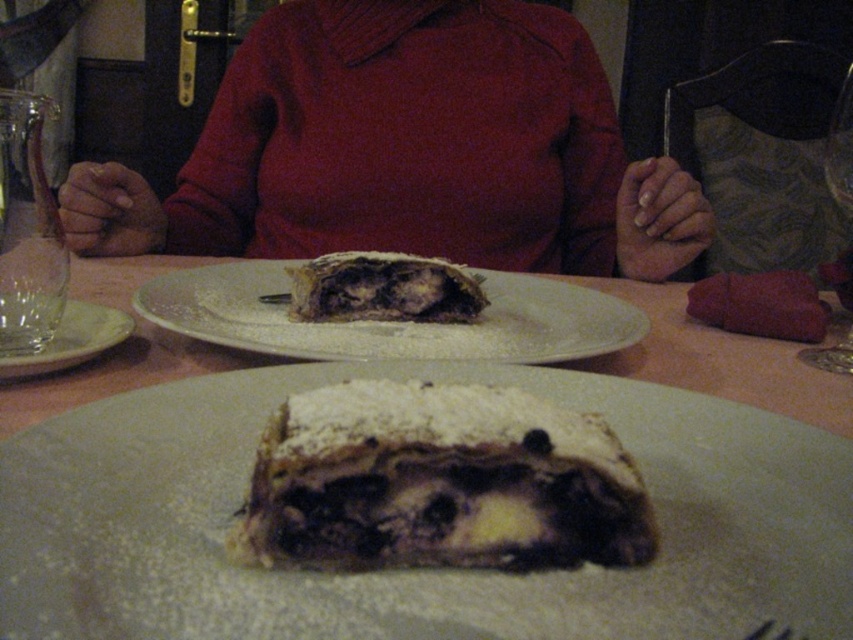
In the scene shown: Is powdery white pastry at center smaller than dusty brown pastry at center?

Yes, powdery white pastry at center is smaller than dusty brown pastry at center.

Is powdery white pastry at center taller than dusty brown pastry at center?

Yes.

This screenshot has width=853, height=640. Find the location of `powdery white pastry at center`. powdery white pastry at center is located at coordinates (440, 483).

Which is above, matte red sweater at center or white ceramic plate at center?

Positioned higher is matte red sweater at center.

Can you confirm if matte red sweater at center is thinner than white ceramic plate at center?

Incorrect, matte red sweater at center's width is not less than white ceramic plate at center's.

Is point (448, 134) positioned before point (506, 282)?

That is False.

Locate an element on the screen. matte red sweater at center is located at coordinates (407, 148).

Can you confirm if powdered white cake at center is wider than dusty brown pastry at center?

Yes, powdered white cake at center is wider than dusty brown pastry at center.

Based on the photo, is powdered white cake at center to the left of dusty brown pastry at center from the viewer's perspective?

In fact, powdered white cake at center is to the right of dusty brown pastry at center.

Identify the location of powdered white cake at center. The width and height of the screenshot is (853, 640). (416, 570).